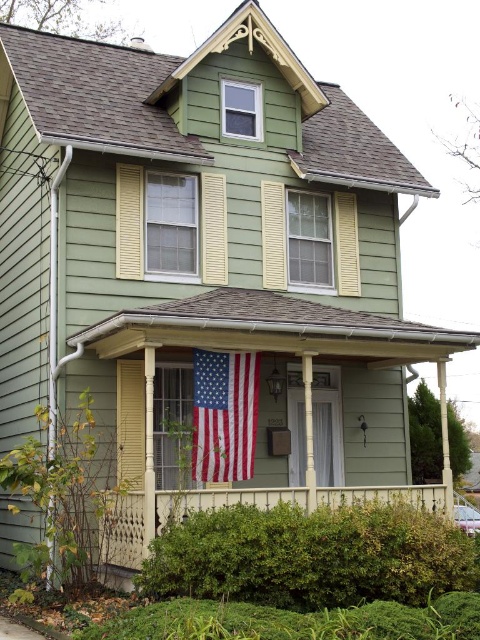
You are a delivery person carrying a package that requires a 5.5 feet clearance to maneuver. You need to walk from the street to the front door of the house. Is there enough space between the matte green porch at center and the american flag at center for you to pass through?

The matte green porch at center is 6.10 feet from the american flag at center, which is wider than the required 5.5 feet clearance. Therefore, there is enough space for you to pass through.

You are a delivery person trying to find the correct house to drop off a package. You see the matte green porch at center and the american flag at center. Which object is bigger in size?

The matte green porch at center is larger in size than the american flag at center.